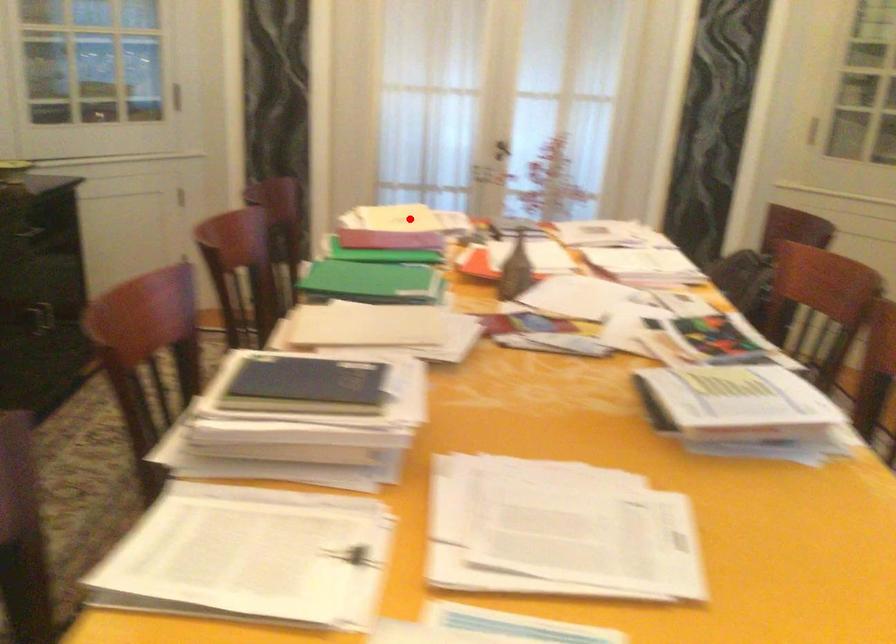
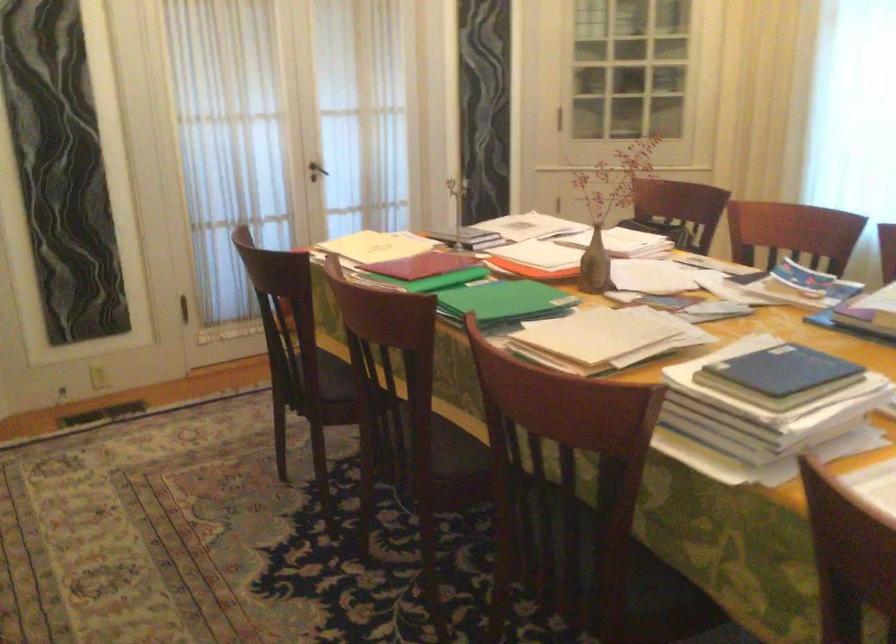
In the second image, find the point that corresponds to the highlighted location in the first image.

(376, 245)